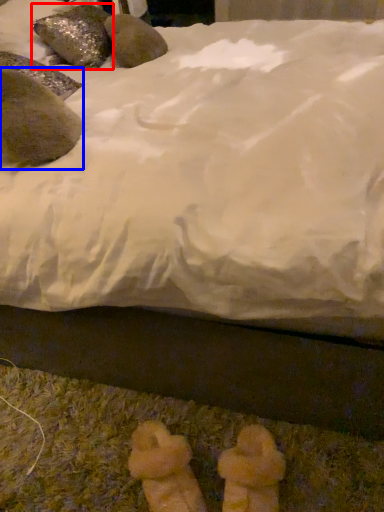
Question: Which object appears closest to the camera in this image, animal (highlighted by a red box) or animal (highlighted by a blue box)?

Choices:
 (A) animal
 (B) animal

Answer: (B)